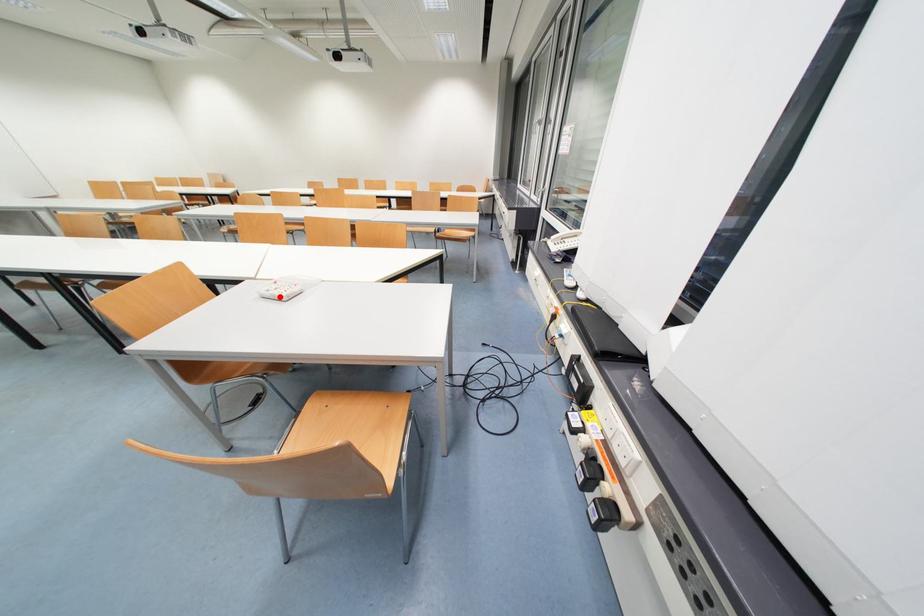
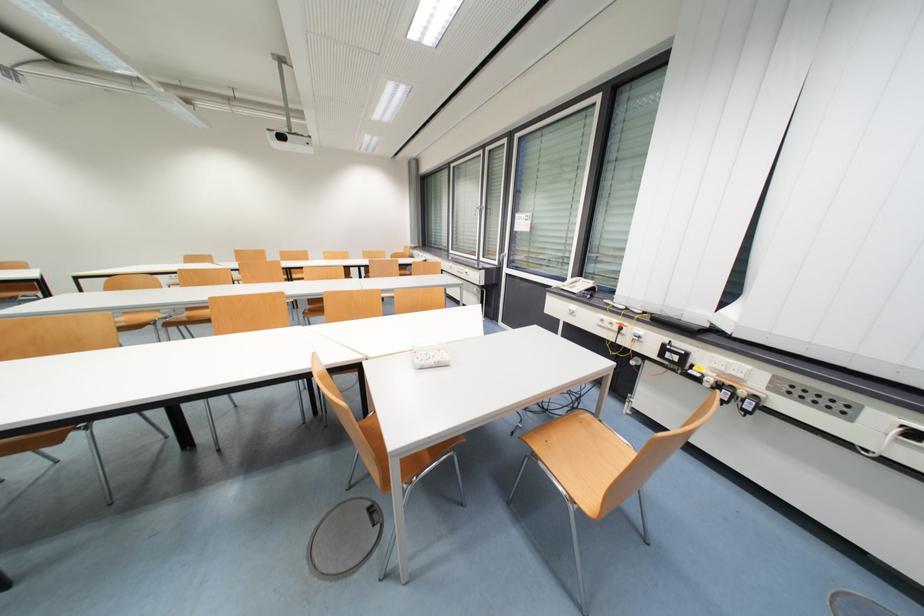
Locate, in the second image, the point that corresponds to the highlighted location in the first image.

(444, 363)